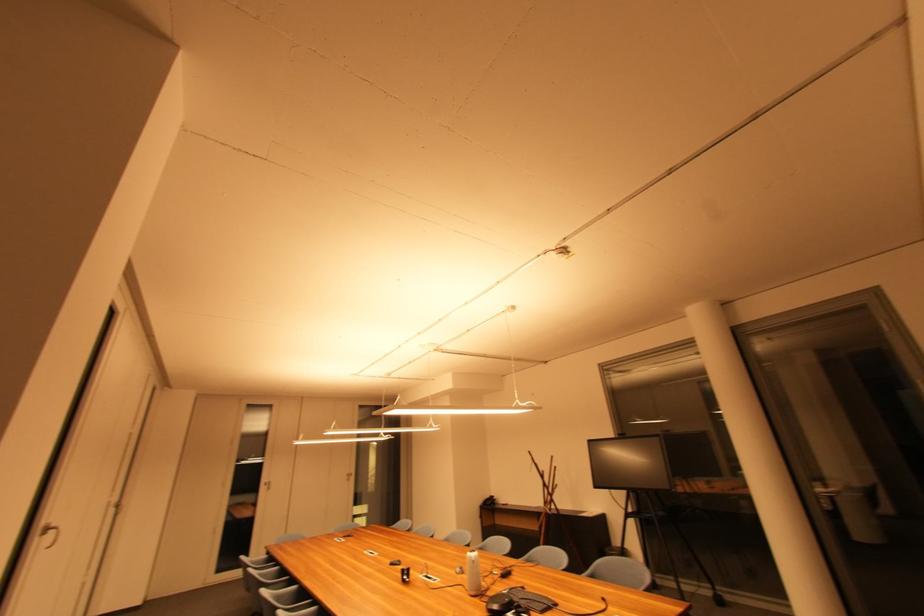
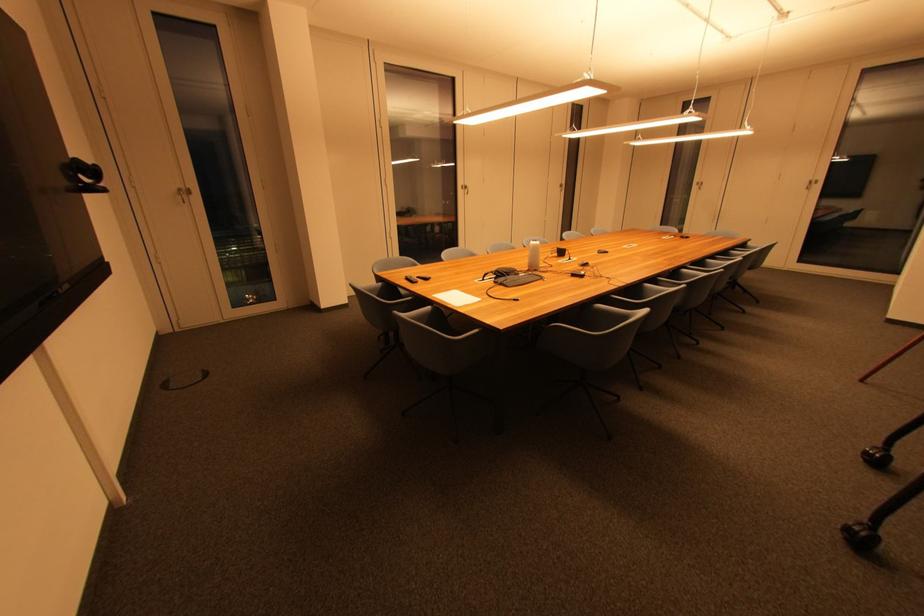
In the second image, find the point that corresponds to pixel 475 557 in the first image.

(538, 244)